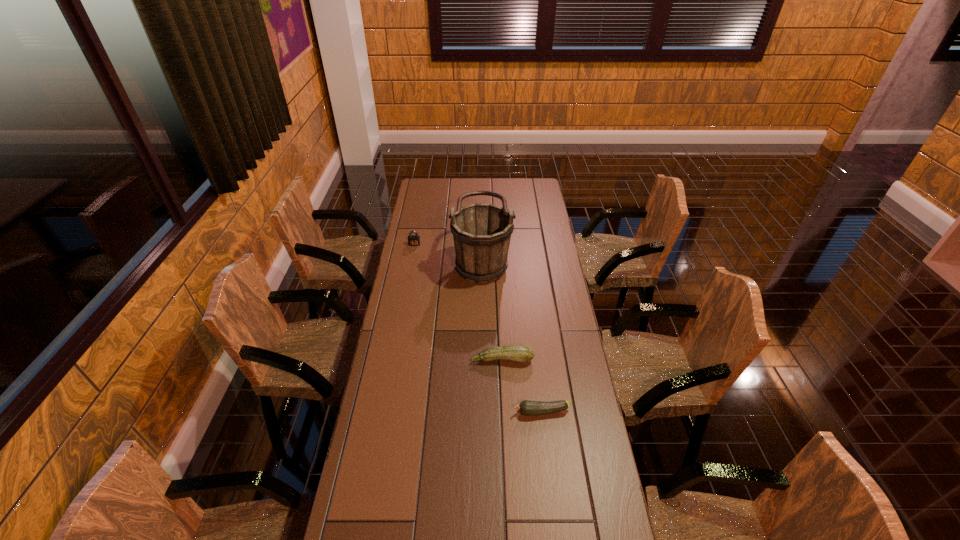
Locate an element on the screen. Image resolution: width=960 pixels, height=540 pixels. blank area located on the front of the third shortest object near the keyhole is located at coordinates 410,271.

Identify the location of vacant area situated at the stem end of the taller zucchini. Image resolution: width=960 pixels, height=540 pixels. (503, 378).

Identify the location of vacant space located 0.400m at the blossom end of the shortest object. (392, 412).

The image size is (960, 540). Identify the location of free space located 0.350m at the blossom end of the shortest object. (407, 412).

At what (x,y) coordinates should I click in order to perform the action: click on vacant space situated 0.270m at the blossom end of the shortest object. Please return your answer as a coordinate pair (x, y). Looking at the image, I should click on (432, 412).

Find the location of a particular element. The image size is (960, 540). object that is at the left edge is located at coordinates (413, 240).

Identify the location of object at the right edge. This screenshot has height=540, width=960. (529, 408).

Locate an element on the screen. This screenshot has height=540, width=960. free space at the far edge is located at coordinates coord(446,194).

Find the location of a particular element. The image size is (960, 540). free space at the left edge of the desktop is located at coordinates (412, 303).

The width and height of the screenshot is (960, 540). Identify the location of vacant space at the right edge of the desktop. (578, 356).